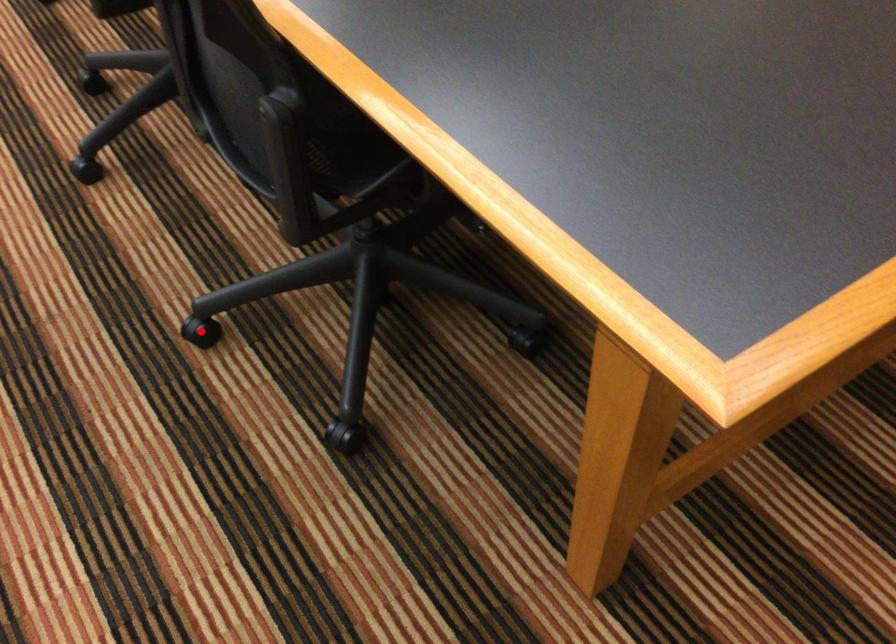
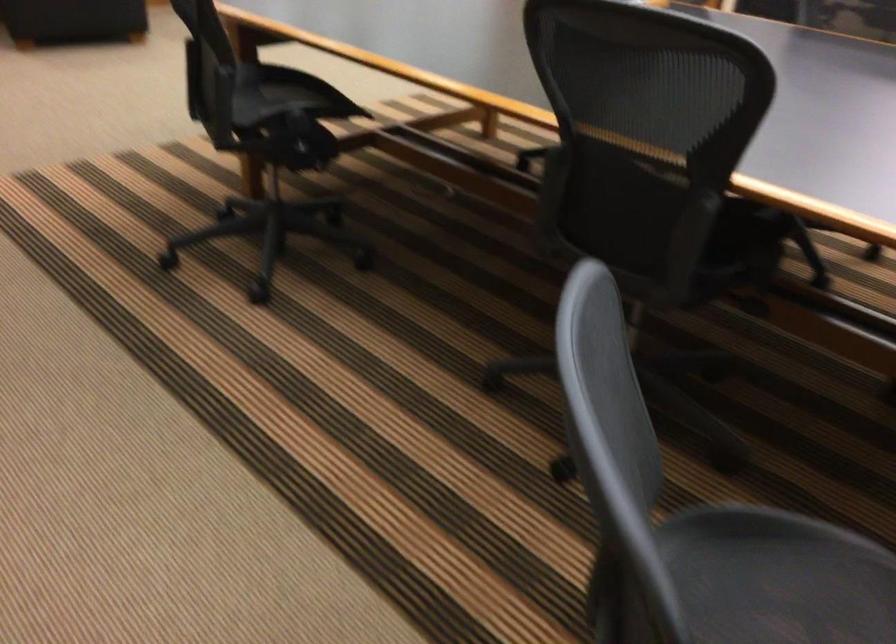
Question: I am providing you with two images of the same scene from different viewpoints. A red point is marked on the first image. At the location where the point appears in image 1, is it still visible in image 2?

Choices:
 (A) Yes
 (B) No

Answer: (B)